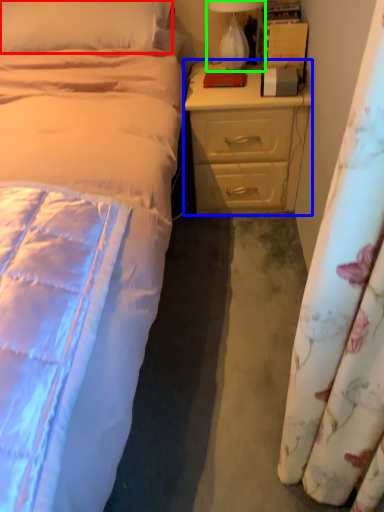
Question: Which object is positioned farthest from pillow (highlighted by a red box)? Select from nightstand (highlighted by a blue box) and lamp (highlighted by a green box).

Choices:
 (A) nightstand
 (B) lamp

Answer: (A)